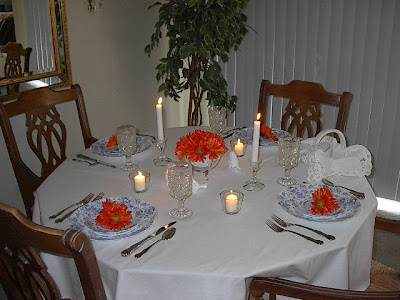
Locate an element on the screen. This screenshot has height=300, width=400. drinking glass is located at coordinates (185, 183), (128, 138), (220, 113), (292, 158).